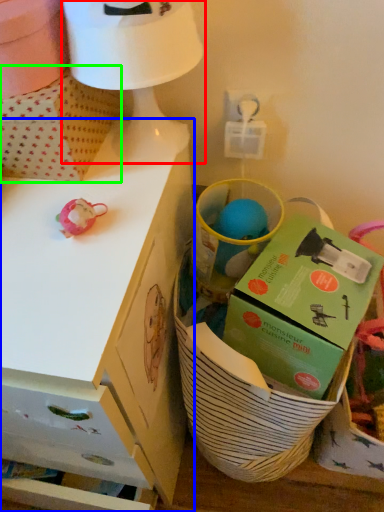
Question: Which is nearer to the table lamp (highlighted by a red box)? desk (highlighted by a blue box) or cardboard box (highlighted by a green box).

Choices:
 (A) desk
 (B) cardboard box

Answer: (B)